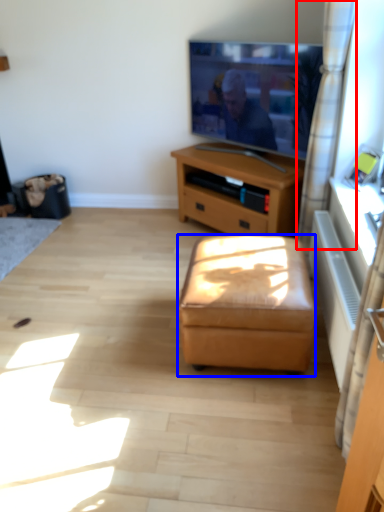
Question: Which object appears farthest to the camera in this image, curtain (highlighted by a red box) or stool (highlighted by a blue box)?

Choices:
 (A) curtain
 (B) stool

Answer: (A)